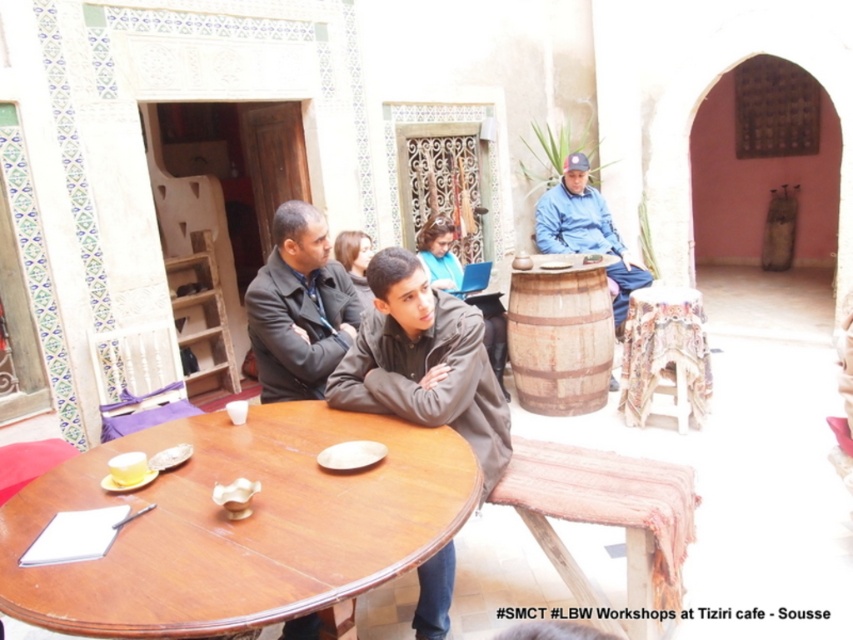
Question: Does patterned fabric table at center appear over blue denim jacket at center?

Choices:
 (A) no
 (B) yes

Answer: (A)

Question: Is patterned fabric table at center further to the viewer compared to blue denim jacket at center?

Choices:
 (A) no
 (B) yes

Answer: (A)

Question: Which point appears farthest from the camera in this image?

Choices:
 (A) (256, 349)
 (B) (224, 436)

Answer: (A)

Question: Does dark gray suit at center come behind wooden barrel at center?

Choices:
 (A) no
 (B) yes

Answer: (A)

Question: Which of the following is the farthest from the observer?

Choices:
 (A) wooden barrel at center
 (B) patterned fabric table at center

Answer: (A)

Question: Which of the following is the closest to the observer?

Choices:
 (A) (294, 380)
 (B) (552, 205)

Answer: (A)